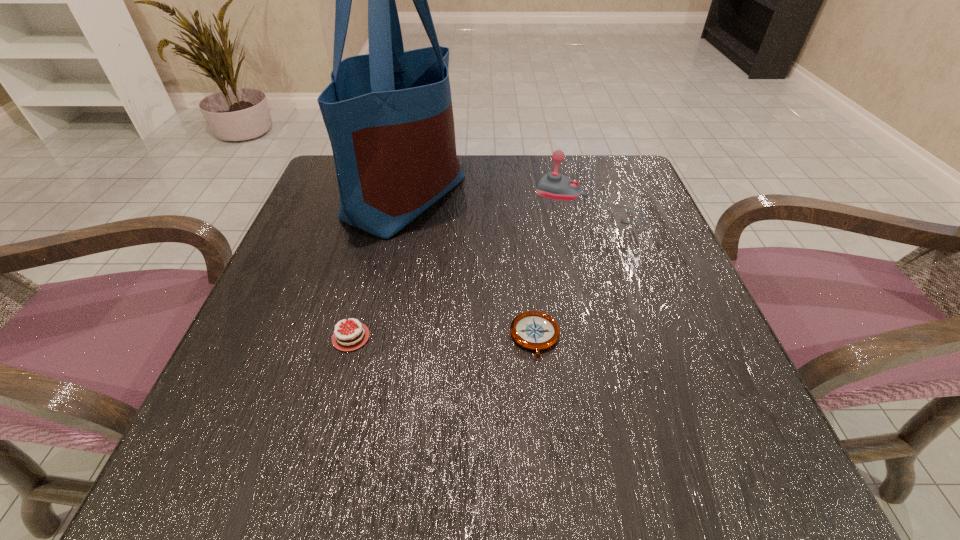
What are the coordinates of `handbag` in the screenshot? It's located at (389, 116).

I want to click on the second tallest object, so click(x=554, y=185).

Find the location of a particular element. This screenshot has width=960, height=540. chocolate cake is located at coordinates (342, 342).

Image resolution: width=960 pixels, height=540 pixels. I want to click on compass, so click(534, 330).

What are the coordinates of `blank space located 0.160m on the right of the tallest object` in the screenshot? It's located at (537, 197).

This screenshot has height=540, width=960. Find the location of `free spot located 0.360m on the left of the second tallest object`. free spot located 0.360m on the left of the second tallest object is located at coordinates (370, 204).

I want to click on free region located 0.160m on the right of the second shortest object, so click(x=500, y=338).

Identify the location of vacant space situated 0.180m on the back of the shortest object. (524, 244).

You are a GUI agent. You are given a task and a screenshot of the screen. Output one action in this format:
    pyautogui.click(x=<x>, y=<y>)
    Task: Click on the handbag present at the far edge
    
    Given the screenshot: What is the action you would take?
    pyautogui.click(x=389, y=116)

The width and height of the screenshot is (960, 540). I want to click on joystick that is at the far edge, so click(554, 185).